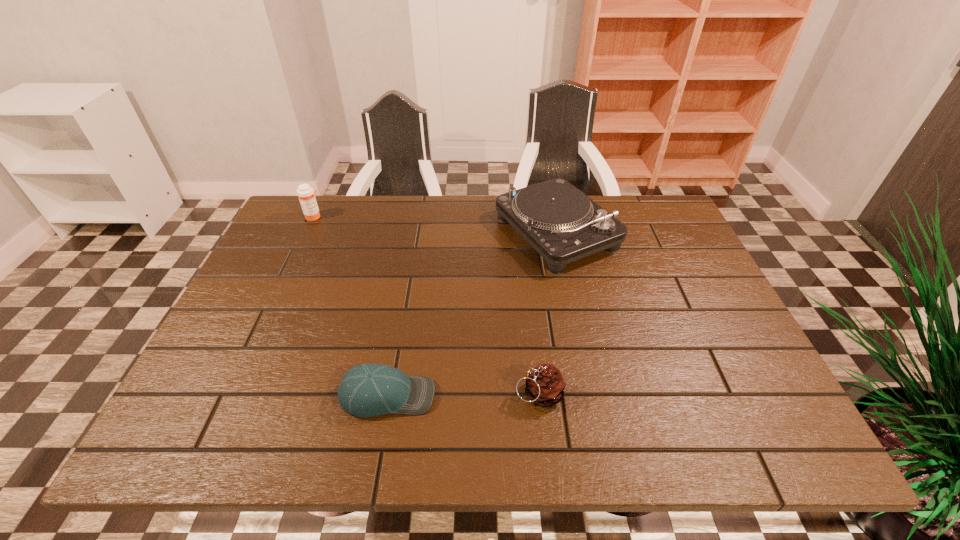
What are the coordinates of `blank space located on the right of the third object from right to left` in the screenshot? It's located at (567, 395).

In order to click on record player present at the far edge in this screenshot , I will do `click(559, 221)`.

Image resolution: width=960 pixels, height=540 pixels. Identify the location of medicine located at the far edge. (306, 194).

Where is `pinecone present at the near edge`? The width and height of the screenshot is (960, 540). pinecone present at the near edge is located at coordinates (545, 385).

The width and height of the screenshot is (960, 540). I want to click on baseball cap at the near edge, so click(371, 389).

The image size is (960, 540). Identify the location of object that is at the left edge. (306, 194).

Locate an element on the screen. object located at the far left corner is located at coordinates (306, 194).

What are the coordinates of `vacant space at the far edge of the desktop` in the screenshot? It's located at (444, 215).

Where is `vacant space at the near edge of the desktop`? vacant space at the near edge of the desktop is located at coordinates (516, 415).

What are the coordinates of `vacant space at the left edge` in the screenshot? It's located at pos(245,385).